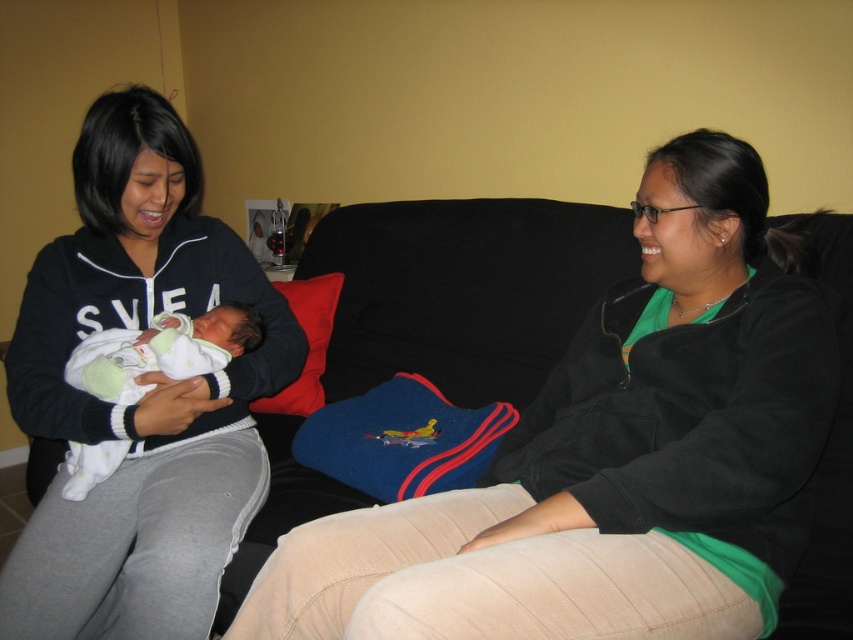
Question: Estimate the real-world distances between objects in this image. Which object is closer to the white knit sweater at left?

Choices:
 (A) matte black jacket at center
 (B) matte black hoodie at left

Answer: (B)

Question: Does matte black jacket at center have a smaller size compared to white knit sweater at left?

Choices:
 (A) no
 (B) yes

Answer: (A)

Question: Estimate the real-world distances between objects in this image. Which object is farther from the matte black jacket at center?

Choices:
 (A) matte black hoodie at left
 (B) white knit sweater at left

Answer: (B)

Question: Is matte black jacket at center positioned behind white knit sweater at left?

Choices:
 (A) no
 (B) yes

Answer: (A)

Question: Which point is farther to the camera?

Choices:
 (A) (227, 316)
 (B) (16, 611)
 (C) (785, 445)

Answer: (A)

Question: Does matte black hoodie at left come behind white knit sweater at left?

Choices:
 (A) yes
 (B) no

Answer: (B)